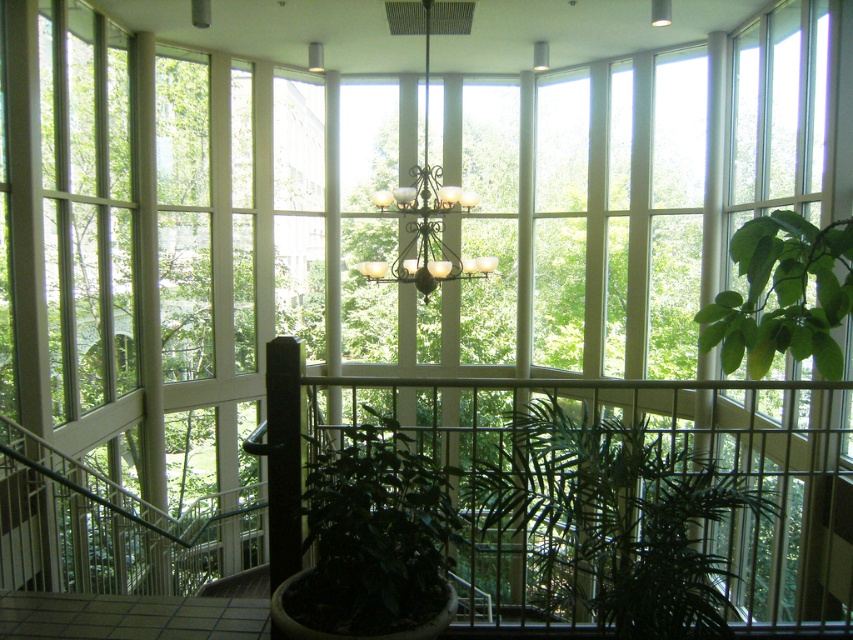
Question: Considering the real-world distances, which object is farthest from the green matte plant at center?

Choices:
 (A) green leafy plant at center
 (B) green leafy plant at right
 (C) matte glass chandelier at center

Answer: (C)

Question: Does green matte plant at center appear on the left side of matte glass chandelier at center?

Choices:
 (A) yes
 (B) no

Answer: (A)

Question: Which object is closer to the camera taking this photo?

Choices:
 (A) matte glass chandelier at center
 (B) green leafy plant at center
 (C) green leafy plant at right

Answer: (B)

Question: Estimate the real-world distances between objects in this image. Which object is closer to the green leafy plant at right?

Choices:
 (A) green leafy plant at center
 (B) green matte plant at center

Answer: (A)

Question: Does green leafy plant at right have a greater width compared to matte glass chandelier at center?

Choices:
 (A) yes
 (B) no

Answer: (A)

Question: Is green leafy plant at center thinner than green leafy plant at right?

Choices:
 (A) no
 (B) yes

Answer: (B)